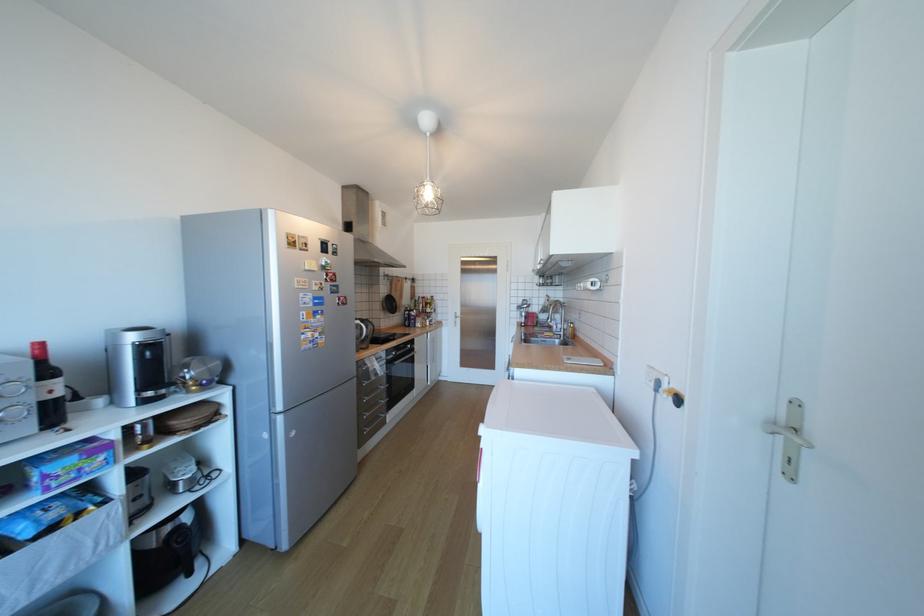
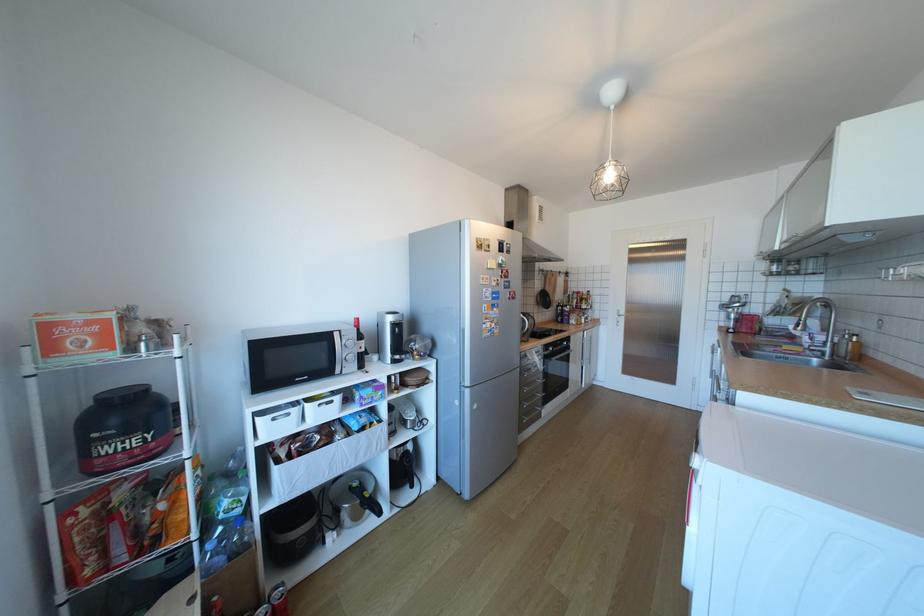
The point at (199, 573) is marked in the first image. Where is the corresponding point in the second image?

(420, 485)